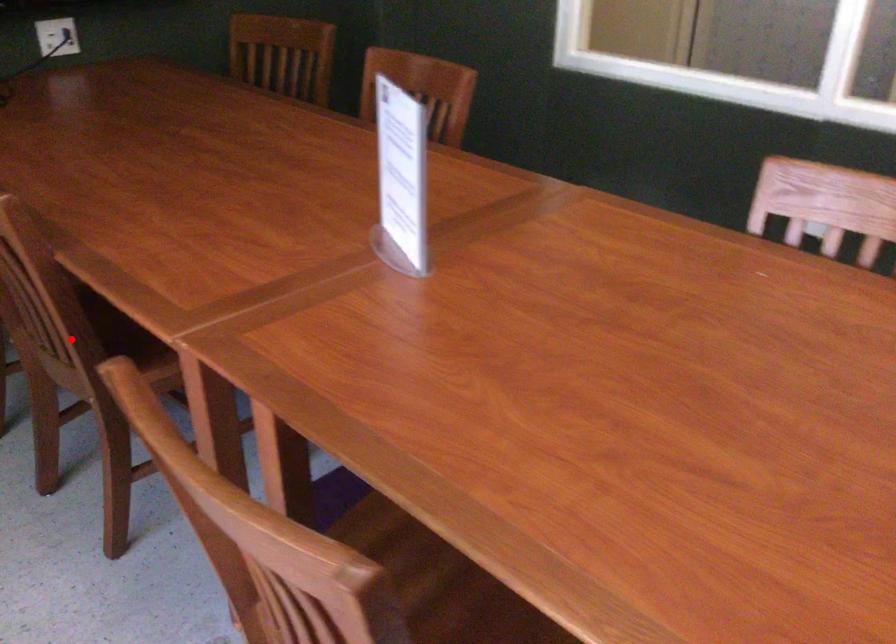
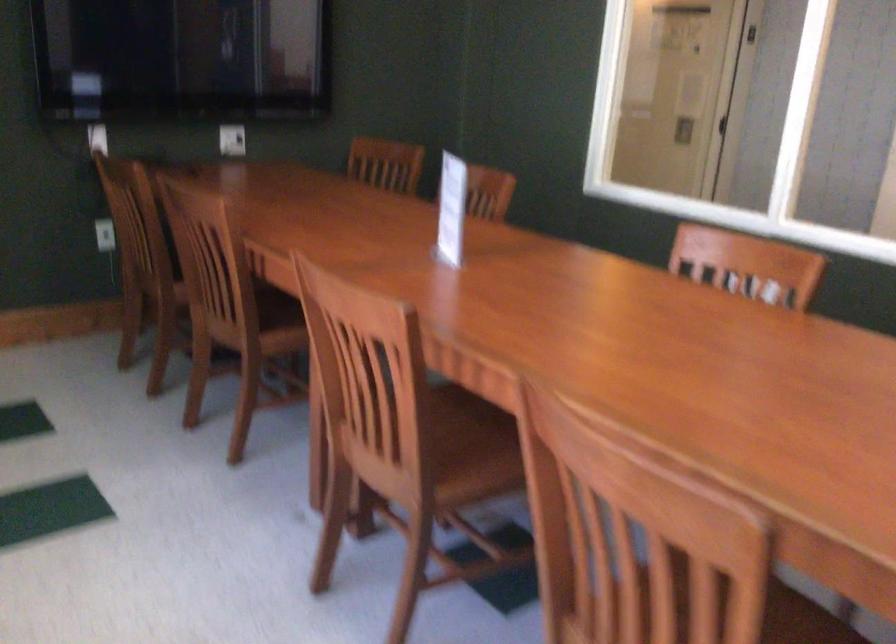
Find the pixel in the second image that matches the highlighted location in the first image.

(239, 303)